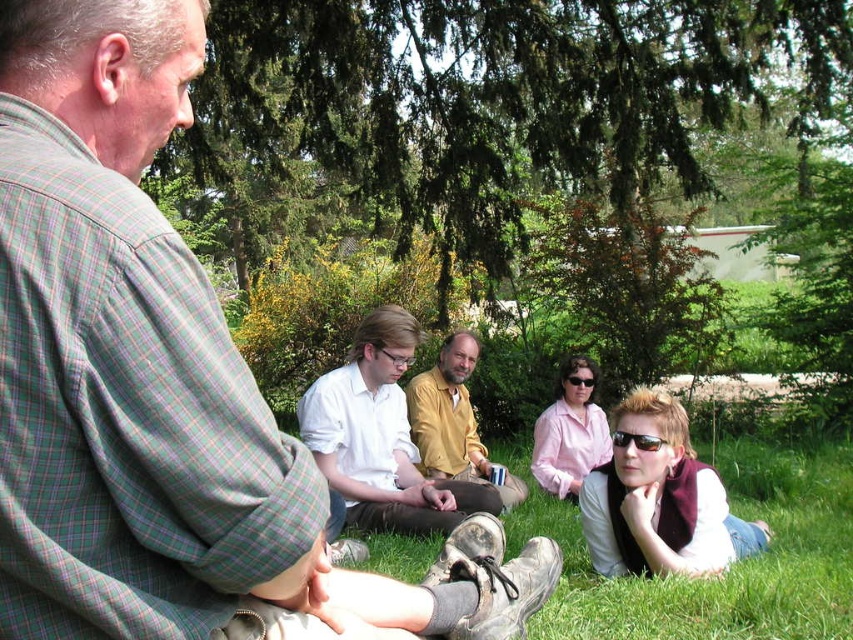
You are standing at the point labeled as point (451, 392) and want to see the person sitting at point (358, 516). Is there any obstruction between you and that person?

Point (358, 516) is in front of point (451, 392), so there is no obstruction between you and the person sitting at point (358, 516).

You are a photographer trying to capture a group photo of the people in the scene. You want to ensure that both the white shirt at center and the matte yellow shirt at center are clearly visible in the photo. Based on their positions, which shirt should you focus on to ensure both are in focus?

The white shirt at center is in front of the matte yellow shirt at center, so focusing on the white shirt at center will ensure both are in focus.